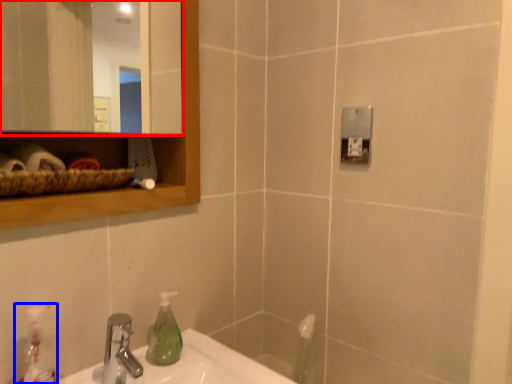
Question: Among these objects, which one is nearest to the camera, mirror (highlighted by a red box) or cleaning product (highlighted by a blue box)?

Choices:
 (A) mirror
 (B) cleaning product

Answer: (A)